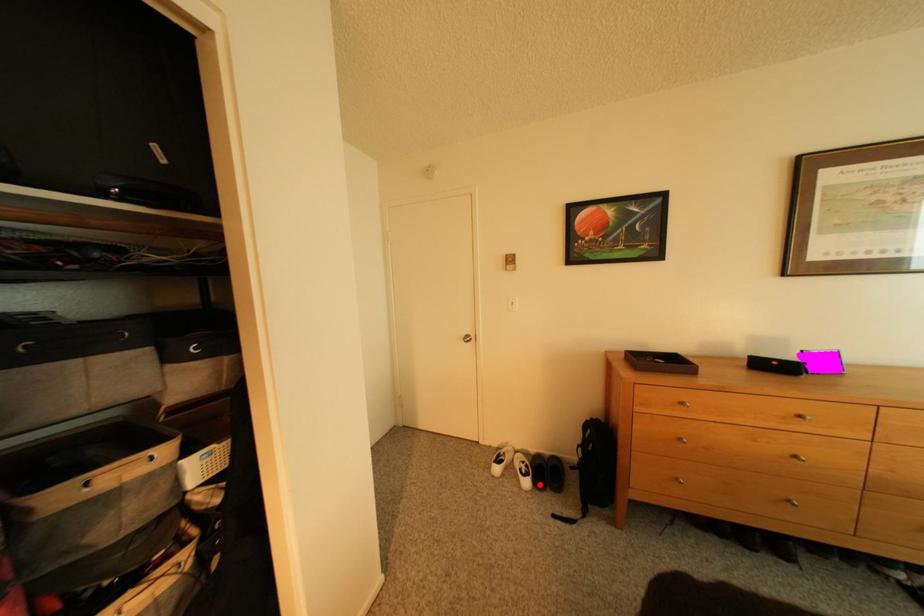
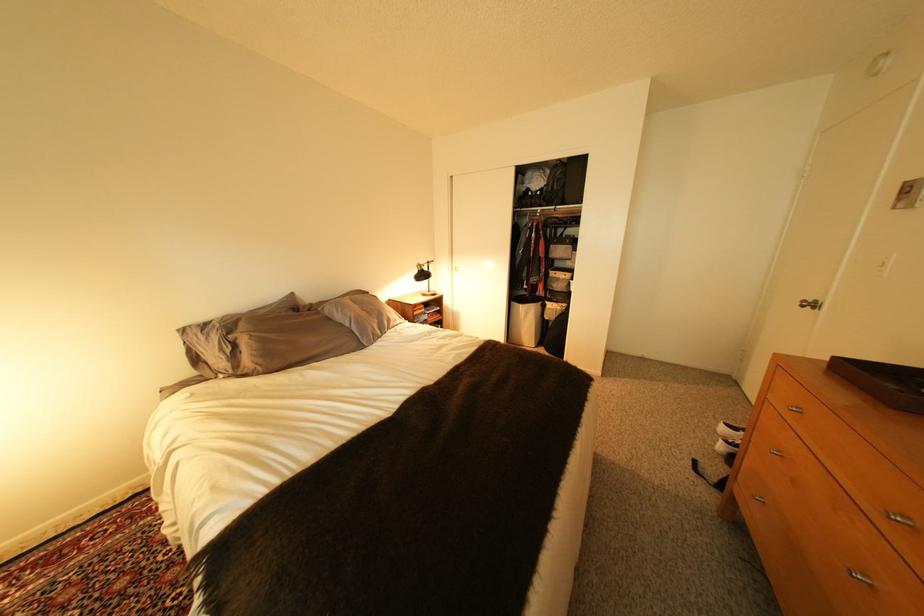
In the second image, find the point that corresponds to the highlighted location in the first image.

(734, 448)